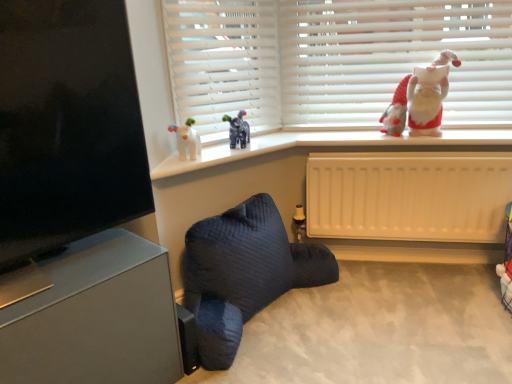
Question: Is dark blue quilted bean bag chair at lower center aimed at white matte blinds at upper center?

Choices:
 (A) yes
 (B) no

Answer: (B)

Question: Is dark blue quilted bean bag chair at lower center positioned behind white matte blinds at upper center?

Choices:
 (A) yes
 (B) no

Answer: (B)

Question: Considering the relative sizes of dark blue quilted bean bag chair at lower center and white matte blinds at upper center in the image provided, is dark blue quilted bean bag chair at lower center wider than white matte blinds at upper center?

Choices:
 (A) no
 (B) yes

Answer: (B)

Question: Is dark blue quilted bean bag chair at lower center not within white matte blinds at upper center?

Choices:
 (A) yes
 (B) no

Answer: (A)

Question: Is dark blue quilted bean bag chair at lower center thinner than white matte blinds at upper center?

Choices:
 (A) yes
 (B) no

Answer: (B)

Question: Can you confirm if dark blue quilted bean bag chair at lower center is bigger than white matte blinds at upper center?

Choices:
 (A) no
 (B) yes

Answer: (B)

Question: Is white matte blinds at upper center at the left side of white plastic window sill at upper center?

Choices:
 (A) no
 (B) yes

Answer: (A)

Question: Considering the relative positions of white matte blinds at upper center and white plastic window sill at upper center in the image provided, is white matte blinds at upper center behind white plastic window sill at upper center?

Choices:
 (A) no
 (B) yes

Answer: (B)

Question: Considering the relative sizes of white matte blinds at upper center and white plastic window sill at upper center in the image provided, is white matte blinds at upper center smaller than white plastic window sill at upper center?

Choices:
 (A) yes
 (B) no

Answer: (B)

Question: Is white matte blinds at upper center positioned before white plastic window sill at upper center?

Choices:
 (A) no
 (B) yes

Answer: (A)

Question: Can you confirm if white matte blinds at upper center is thinner than white plastic window sill at upper center?

Choices:
 (A) no
 (B) yes

Answer: (B)

Question: From the image's perspective, is white matte blinds at upper center over white plastic window sill at upper center?

Choices:
 (A) yes
 (B) no

Answer: (A)

Question: Considering the relative sizes of black matte screen at upper left and dark blue quilted bean bag chair at lower center in the image provided, is black matte screen at upper left taller than dark blue quilted bean bag chair at lower center?

Choices:
 (A) yes
 (B) no

Answer: (A)